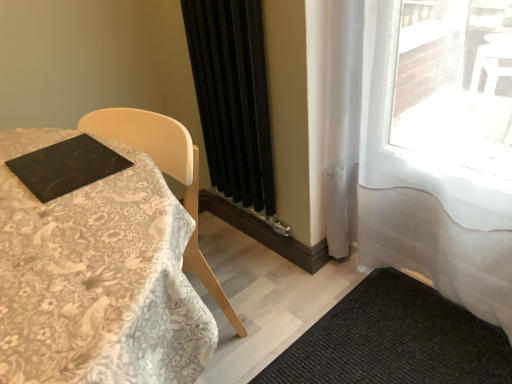
The width and height of the screenshot is (512, 384). What do you see at coordinates (428, 198) in the screenshot? I see `white sheer curtain at right, which is counted as the 2th curtain, starting from the left` at bounding box center [428, 198].

This screenshot has width=512, height=384. What do you see at coordinates (232, 97) in the screenshot? I see `black matte curtain at center, placed as the 1th curtain when sorted from left to right` at bounding box center [232, 97].

Measure the distance between point (409,333) and camera.

They are 4.63 feet apart.

The height and width of the screenshot is (384, 512). Describe the element at coordinates (97, 277) in the screenshot. I see `white lace tablecloth at left` at that location.

Based on the photo, in order to face white lace tablecloth at left, should I rotate leftwards or rightwards?

To align with it, rotate left about 16.586°.

The height and width of the screenshot is (384, 512). In order to click on white sheer curtain at right, which is counted as the 2th curtain, starting from the left in this screenshot , I will do `click(428, 198)`.

Is white sheer curtain at right, which is counted as the 2th curtain, starting from the left, inside black matte curtain at center, placed as the 1th curtain when sorted from left to right?

No, white sheer curtain at right, which is counted as the 2th curtain, starting from the left, is not surrounded by black matte curtain at center, placed as the 1th curtain when sorted from left to right.

Considering the sizes of objects black matte curtain at center, the 2th curtain in the right-to-left sequence, and white sheer curtain at right, the first curtain from the right, in the image provided, who is taller, black matte curtain at center, the 2th curtain in the right-to-left sequence, or white sheer curtain at right, the first curtain from the right,?

white sheer curtain at right, the first curtain from the right, is taller.

From a real-world perspective, is black matte curtain at center, placed as the 1th curtain when sorted from left to right, below white sheer curtain at right, the first curtain from the right?

No, from a real-world perspective, black matte curtain at center, placed as the 1th curtain when sorted from left to right, is not below white sheer curtain at right, the first curtain from the right.

Considering the relative sizes of black matte curtain at center, placed as the 1th curtain when sorted from left to right, and white sheer curtain at right, which is counted as the 2th curtain, starting from the left, in the image provided, is black matte curtain at center, placed as the 1th curtain when sorted from left to right, thinner than white sheer curtain at right, which is counted as the 2th curtain, starting from the left,?

Yes, black matte curtain at center, placed as the 1th curtain when sorted from left to right, is thinner than white sheer curtain at right, which is counted as the 2th curtain, starting from the left.

From the picture: From a real-world perspective, is white lace tablecloth at left above or below white sheer curtain at right, which is counted as the 2th curtain, starting from the left?

white lace tablecloth at left is below white sheer curtain at right, which is counted as the 2th curtain, starting from the left.

Is white lace tablecloth at left bigger or smaller than white sheer curtain at right, the first curtain from the right?

In the image, white lace tablecloth at left appears to be larger than white sheer curtain at right, the first curtain from the right.

Which object is positioned more to the left, white lace tablecloth at left or white sheer curtain at right, the first curtain from the right?

From the viewer's perspective, white lace tablecloth at left appears more on the left side.

Can white sheer curtain at right, which is counted as the 2th curtain, starting from the left, be found inside white lace tablecloth at left?

Definitely not — white sheer curtain at right, which is counted as the 2th curtain, starting from the left, is not inside white lace tablecloth at left.

Does point (335, 333) come behind point (221, 174)?

No, (335, 333) is in front of (221, 174).

Does black textured mat at lower right appear on the left side of black matte curtain at center, placed as the 1th curtain when sorted from left to right?

Incorrect, black textured mat at lower right is not on the left side of black matte curtain at center, placed as the 1th curtain when sorted from left to right.

Can black matte curtain at center, the 2th curtain in the right-to-left sequence, be found inside black textured mat at lower right?

No, black textured mat at lower right does not contain black matte curtain at center, the 2th curtain in the right-to-left sequence.

From the image's perspective, relative to black matte curtain at center, placed as the 1th curtain when sorted from left to right, is black textured mat at lower right above or below?

black textured mat at lower right is situated lower than black matte curtain at center, placed as the 1th curtain when sorted from left to right, in the image.

Which is in front, point (373, 15) or point (139, 162)?

Point (139, 162)

Is white sheer curtain at right, which is counted as the 2th curtain, starting from the left, wider than white lace tablecloth at left?

In fact, white sheer curtain at right, which is counted as the 2th curtain, starting from the left, might be narrower than white lace tablecloth at left.

From the image's perspective, between white sheer curtain at right, which is counted as the 2th curtain, starting from the left, and white lace tablecloth at left, who is located below?

white lace tablecloth at left is shown below in the image.

Is white sheer curtain at right, which is counted as the 2th curtain, starting from the left, oriented away from white lace tablecloth at left?

white sheer curtain at right, which is counted as the 2th curtain, starting from the left, does not have its back to white lace tablecloth at left.

In the scene shown: Who is smaller, white lace tablecloth at left or black matte curtain at center, placed as the 1th curtain when sorted from left to right?

With smaller size is black matte curtain at center, placed as the 1th curtain when sorted from left to right.

Is white lace tablecloth at left to the left or to the right of black matte curtain at center, placed as the 1th curtain when sorted from left to right, in the image?

white lace tablecloth at left is positioned on black matte curtain at center, placed as the 1th curtain when sorted from left to right,'s left side.

Where is `table on the left of black matte curtain at center, placed as the 1th curtain when sorted from left to right`? The image size is (512, 384). table on the left of black matte curtain at center, placed as the 1th curtain when sorted from left to right is located at coordinates (97, 277).

Looking at this image, does white lace tablecloth at left have a greater width compared to black matte curtain at center, the 2th curtain in the right-to-left sequence?

Yes, white lace tablecloth at left is wider than black matte curtain at center, the 2th curtain in the right-to-left sequence.

Is black matte curtain at center, the 2th curtain in the right-to-left sequence, located outside white lace tablecloth at left?

Yes, black matte curtain at center, the 2th curtain in the right-to-left sequence, is outside of white lace tablecloth at left.

In the image, is black matte curtain at center, placed as the 1th curtain when sorted from left to right, positioned in front of or behind white lace tablecloth at left?

In the image, black matte curtain at center, placed as the 1th curtain when sorted from left to right, appears behind white lace tablecloth at left.

Is white sheer curtain at right, the first curtain from the right, spatially inside black textured mat at lower right, or outside of it?

white sheer curtain at right, the first curtain from the right, is located beyond the bounds of black textured mat at lower right.

Are white sheer curtain at right, the first curtain from the right, and black textured mat at lower right far apart?

No, white sheer curtain at right, the first curtain from the right, is not far from black textured mat at lower right.

Considering the sizes of white sheer curtain at right, the first curtain from the right, and black textured mat at lower right in the image, is white sheer curtain at right, the first curtain from the right, wider or thinner than black textured mat at lower right?

Clearly, white sheer curtain at right, the first curtain from the right, has less width compared to black textured mat at lower right.

Between point (461, 235) and point (356, 357), which one is positioned in front?

Positioned in front is point (461, 235).

Identify the location of curtain in front of the black matte curtain at center, placed as the 1th curtain when sorted from left to right. [428, 198].

What are the coordinates of `table that appears below the white sheer curtain at right, which is counted as the 2th curtain, starting from the left (from a real-world perspective)` in the screenshot? It's located at (97, 277).

When comparing their distances from white sheer curtain at right, the first curtain from the right, does black matte curtain at center, the 2th curtain in the right-to-left sequence, or white lace tablecloth at left seem further?

Among the two, white lace tablecloth at left is located further to white sheer curtain at right, the first curtain from the right.

Based on their spatial positions, is white lace tablecloth at left or black matte curtain at center, placed as the 1th curtain when sorted from left to right, closer to white sheer curtain at right, the first curtain from the right?

black matte curtain at center, placed as the 1th curtain when sorted from left to right, is closer to white sheer curtain at right, the first curtain from the right.

Considering their positions, is white lace tablecloth at left positioned closer to black matte curtain at center, placed as the 1th curtain when sorted from left to right, than white sheer curtain at right, the first curtain from the right?

white sheer curtain at right, the first curtain from the right, is closer to black matte curtain at center, placed as the 1th curtain when sorted from left to right.

Which object lies nearer to the anchor point black matte curtain at center, placed as the 1th curtain when sorted from left to right, white sheer curtain at right, the first curtain from the right, or black textured mat at lower right?

Among the two, white sheer curtain at right, the first curtain from the right, is located nearer to black matte curtain at center, placed as the 1th curtain when sorted from left to right.

Looking at the image, which one is located further to black textured mat at lower right, black matte curtain at center, placed as the 1th curtain when sorted from left to right, or white sheer curtain at right, which is counted as the 2th curtain, starting from the left?

Among the two, black matte curtain at center, placed as the 1th curtain when sorted from left to right, is located further to black textured mat at lower right.

Which object lies further to the anchor point white lace tablecloth at left, black textured mat at lower right or white sheer curtain at right, the first curtain from the right?

Among the two, white sheer curtain at right, the first curtain from the right, is located further to white lace tablecloth at left.

From the image, which object appears to be farther from white sheer curtain at right, the first curtain from the right, white lace tablecloth at left or black textured mat at lower right?

white lace tablecloth at left is further to white sheer curtain at right, the first curtain from the right.

From the image, which object appears to be farther from white sheer curtain at right, which is counted as the 2th curtain, starting from the left, black matte curtain at center, placed as the 1th curtain when sorted from left to right, or black textured mat at lower right?

The object further to white sheer curtain at right, which is counted as the 2th curtain, starting from the left, is black matte curtain at center, placed as the 1th curtain when sorted from left to right.

You are a GUI agent. You are given a task and a screenshot of the screen. Output one action in this format:
    pyautogui.click(x=<x>, y=<y>)
    Task: Click on the table that lies between black matte curtain at center, the 2th curtain in the right-to-left sequence, and black textured mat at lower right from top to bottom
    The width and height of the screenshot is (512, 384).
    Given the screenshot: What is the action you would take?
    pyautogui.click(x=97, y=277)

Find the location of a particular element. The height and width of the screenshot is (384, 512). curtain between black matte curtain at center, the 2th curtain in the right-to-left sequence, and black textured mat at lower right vertically is located at coordinates (428, 198).

At what (x,y) coordinates should I click in order to perform the action: click on doormat between white lace tablecloth at left and white sheer curtain at right, which is counted as the 2th curtain, starting from the left. Please return your answer as a coordinate pair (x, y). Looking at the image, I should click on (394, 340).

Identify the location of curtain located between white lace tablecloth at left and white sheer curtain at right, which is counted as the 2th curtain, starting from the left, in the left-right direction. This screenshot has height=384, width=512. (232, 97).